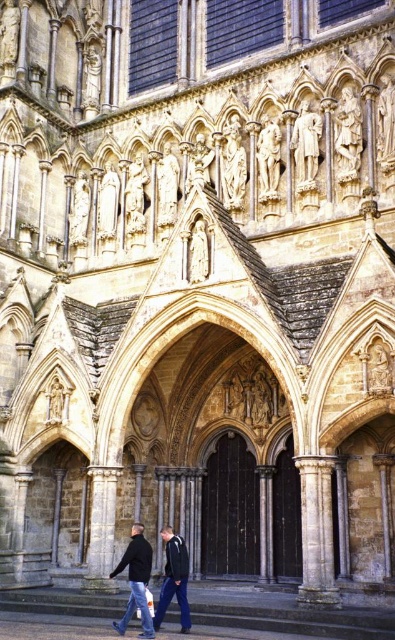
Can you confirm if dark gray jacket at center is thinner than stone statue at center?

Incorrect, dark gray jacket at center's width is not less than stone statue at center's.

Between dark gray jacket at center and stone statue at center, which one appears on the left side from the viewer's perspective?

dark gray jacket at center is more to the left.

Does point (144, 618) lie behind point (308, 102)?

No.

Where is `dark gray jacket at center`? dark gray jacket at center is located at coordinates (137, 580).

What do you see at coordinates (174, 579) in the screenshot? I see `dark blue jacket at center` at bounding box center [174, 579].

Locate an element on the screen. dark blue jacket at center is located at coordinates (174, 579).

This screenshot has width=395, height=640. I want to click on dark blue jacket at center, so click(x=174, y=579).

Can you confirm if dark gray jacket at center is positioned to the right of dark blue jacket at center?

No, dark gray jacket at center is not to the right of dark blue jacket at center.

What do you see at coordinates (137, 580) in the screenshot?
I see `dark gray jacket at center` at bounding box center [137, 580].

This screenshot has width=395, height=640. In order to click on dark gray jacket at center in this screenshot , I will do `click(137, 580)`.